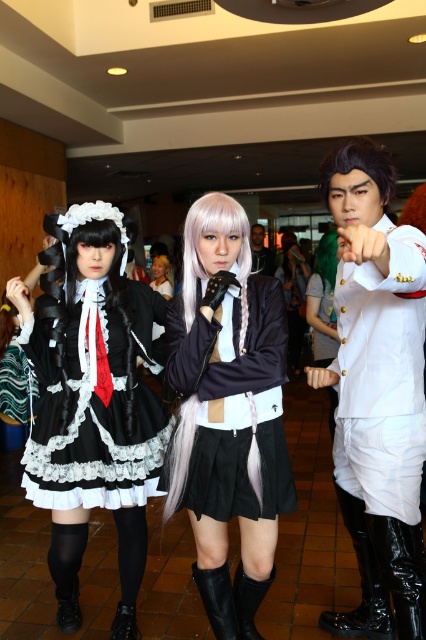
You are a photographer at the event and need to position the matte black dress at center and the smooth white shirt at center for a group photo. Based on their sizes, which one should you place closer to the edges to avoid overcrowding?

The matte black dress at center might be wider than the smooth white shirt at center, so you should place the matte black dress at center closer to the edges to avoid overcrowding.

You are standing at the entrance of the convention center and see the matte black dress at center. If you walk straight towards it, will you reach it before reaching the maid outfit on the left?

The matte black dress at center is located at point 0.664 on the x axis and 0.216 on the y axis. Since you are walking straight towards it from the entrance, you would reach it before the maid outfit on the left, which is positioned to the side.